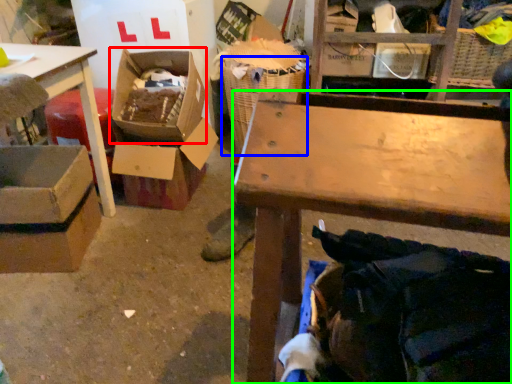
Question: Which object is the closest to the storage box (highlighted by a red box)? Choose among these: laundry basket (highlighted by a blue box) or table (highlighted by a green box).

Choices:
 (A) laundry basket
 (B) table

Answer: (A)